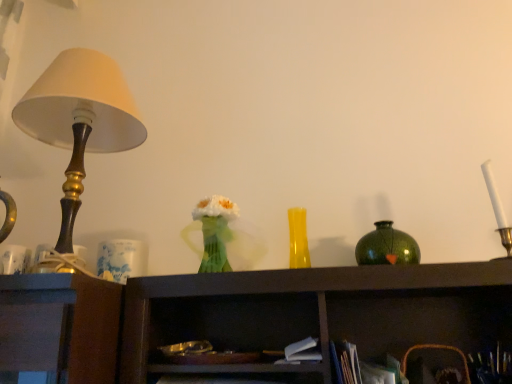
Question: Is point tap(111, 64) closer or farther from the camera than point tap(206, 220)?

Choices:
 (A) farther
 (B) closer

Answer: (A)

Question: Is matte gold lamp at left in front of or behind translucent green vase at center in the image?

Choices:
 (A) behind
 (B) front

Answer: (B)

Question: Based on their relative distances, which object is farther from the green speckled vase at upper right, the second vase when ordered from left to right?

Choices:
 (A) matte gold lamp at left
 (B) yellow glass vase at center, which is counted as the first vase, starting from the left
 (C) translucent green vase at center

Answer: (A)

Question: Based on their relative distances, which object is farther from the translucent green vase at center?

Choices:
 (A) matte gold lamp at left
 (B) green speckled vase at upper right, the 1th vase positioned from the right
 (C) yellow glass vase at center, which is the 2th vase from right to left

Answer: (B)